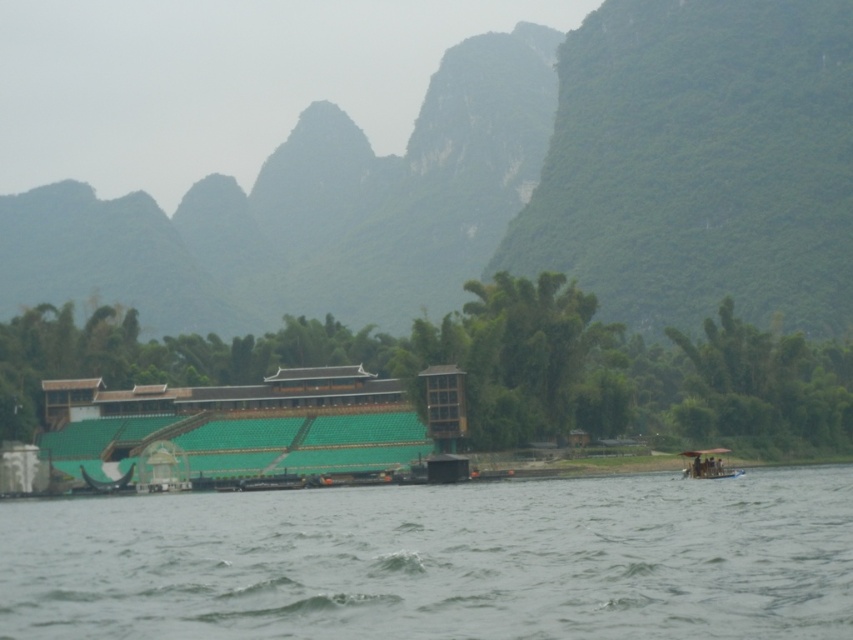
Question: In this image, where is green textured mountain at upper center located relative to gray water at lower center?

Choices:
 (A) right
 (B) left

Answer: (B)

Question: Is green textured mountain at upper center to the right of green leafy mountain at upper right from the viewer's perspective?

Choices:
 (A) no
 (B) yes

Answer: (A)

Question: Which object appears closest to the camera in this image?

Choices:
 (A) gray water at lower center
 (B) black glossy boat at lower left

Answer: (A)

Question: Which of the following is the farthest from the observer?

Choices:
 (A) (679, 10)
 (B) (805, 522)

Answer: (A)

Question: Considering the real-world distances, which object is closest to the green textured mountain at upper center?

Choices:
 (A) wooden boat at lower right
 (B) gray water at lower center
 (C) black glossy boat at lower left

Answer: (B)

Question: Does gray water at lower center have a larger size compared to green leafy mountain at upper right?

Choices:
 (A) yes
 (B) no

Answer: (B)